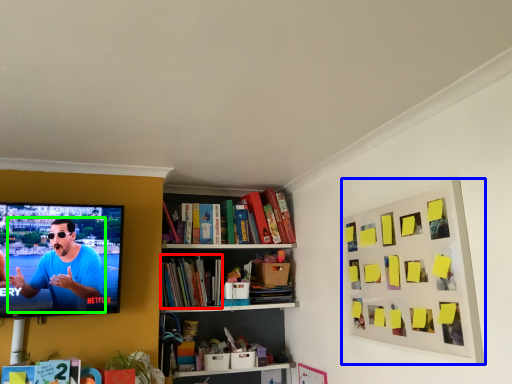
Question: Which object is the closest to the book (highlighted by a red box)? Choose among these: picture frame (highlighted by a blue box) or person (highlighted by a green box).

Choices:
 (A) picture frame
 (B) person

Answer: (B)